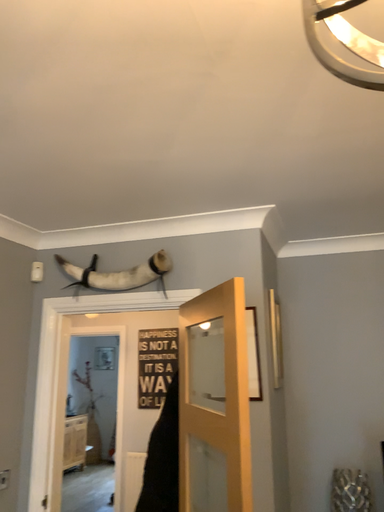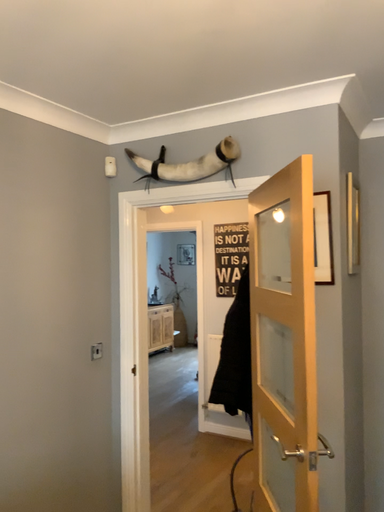
Question: How did the camera likely rotate when shooting the video?

Choices:
 (A) rotated downward
 (B) rotated upward

Answer: (A)